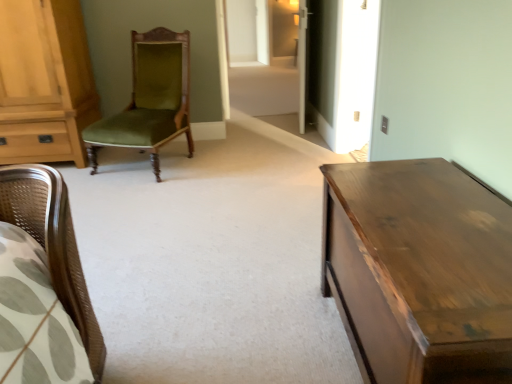
You are a GUI agent. You are given a task and a screenshot of the screen. Output one action in this format:
    pyautogui.click(x=<x>, y=<y>)
    Task: Click on the vacant area that lies to the right of green velvet chair at center
    The image size is (512, 384).
    Given the screenshot: What is the action you would take?
    pyautogui.click(x=236, y=158)